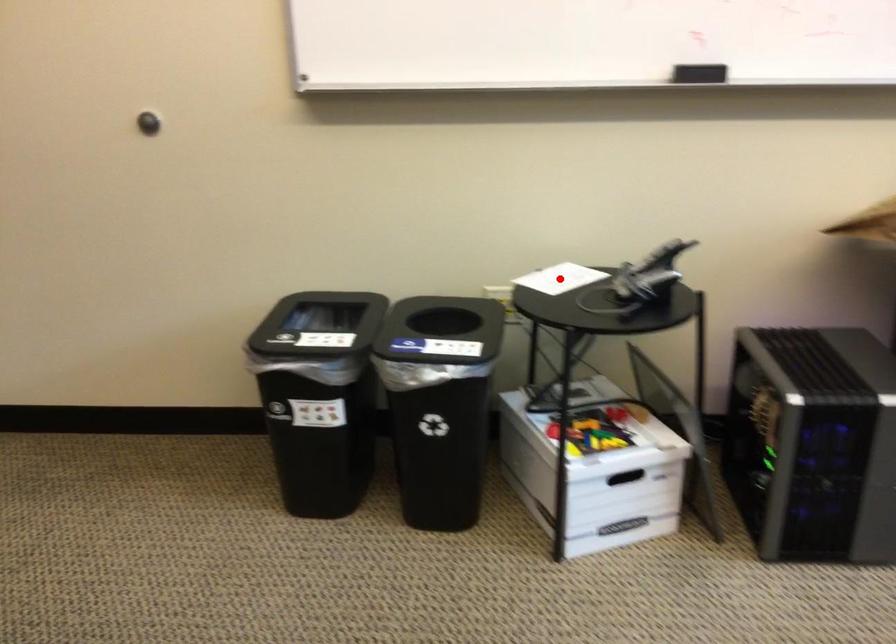
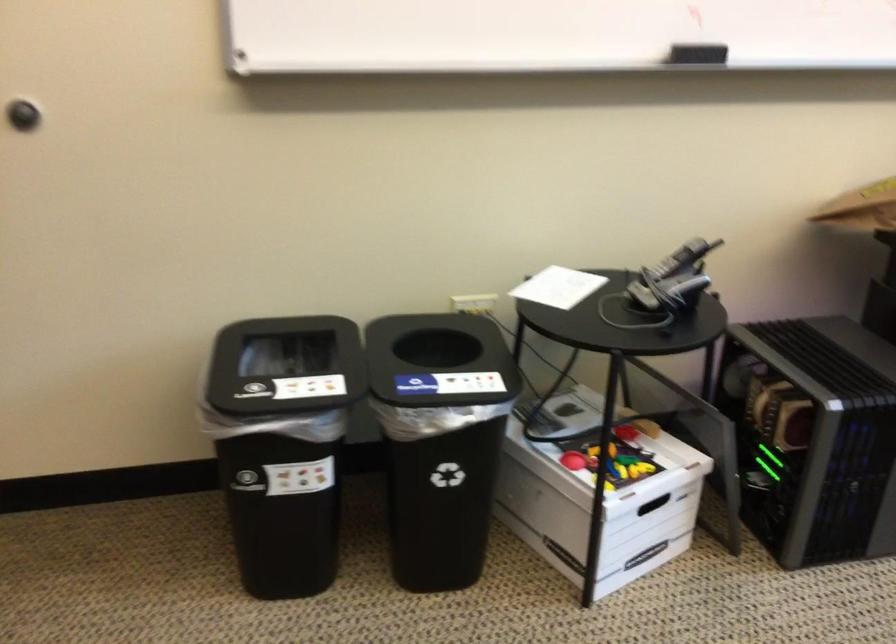
The point at the highlighted location is marked in the first image. Where is the corresponding point in the second image?

(558, 287)